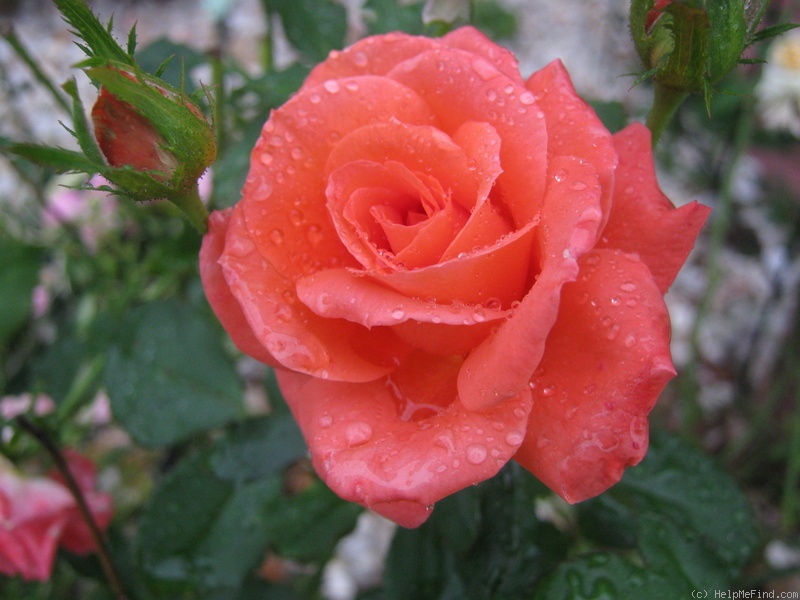
The width and height of the screenshot is (800, 600). Identify the location of bulb. (156, 141), (698, 60).